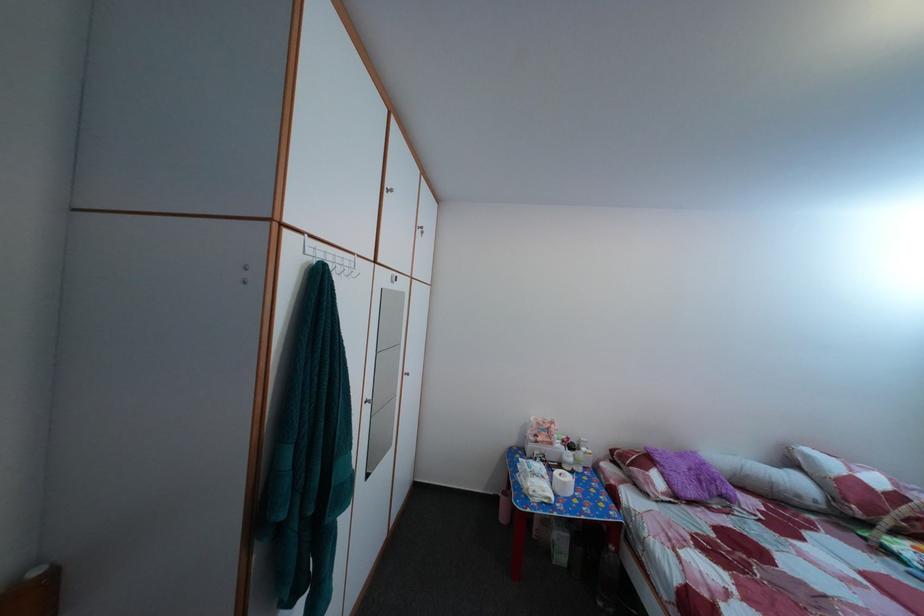
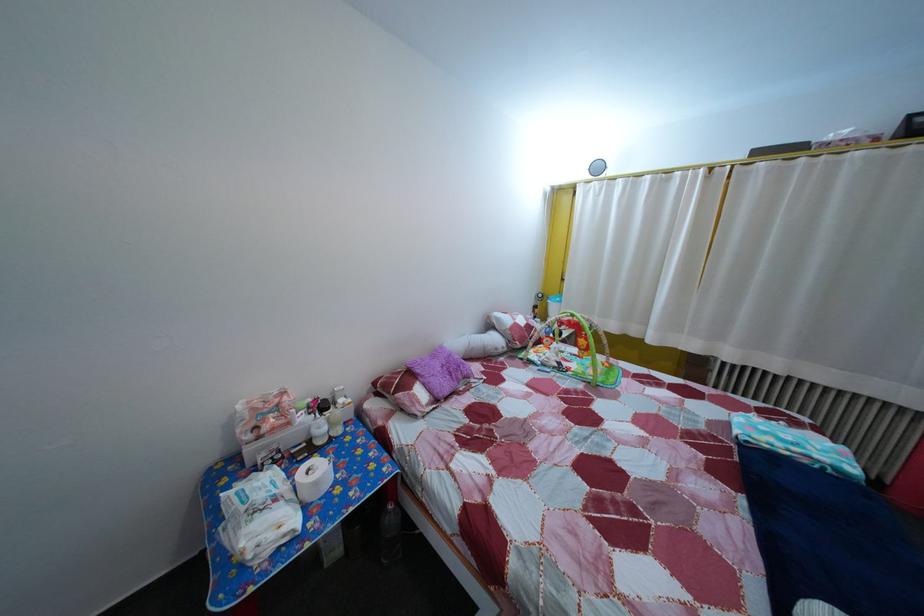
Locate, in the second image, the point that corresponds to [809,493] in the first image.

(505, 347)